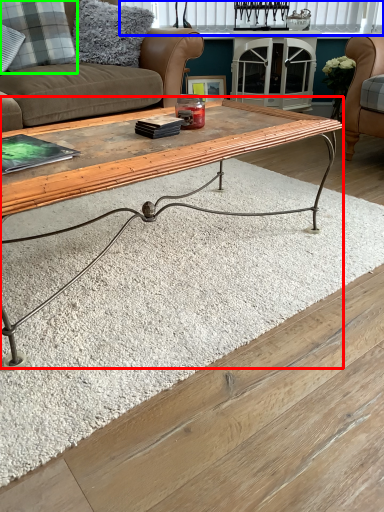
Question: Which object is positioned closest to coffee table (highlighted by a red box)? Select from window (highlighted by a blue box) and pillow (highlighted by a green box).

Choices:
 (A) window
 (B) pillow

Answer: (B)